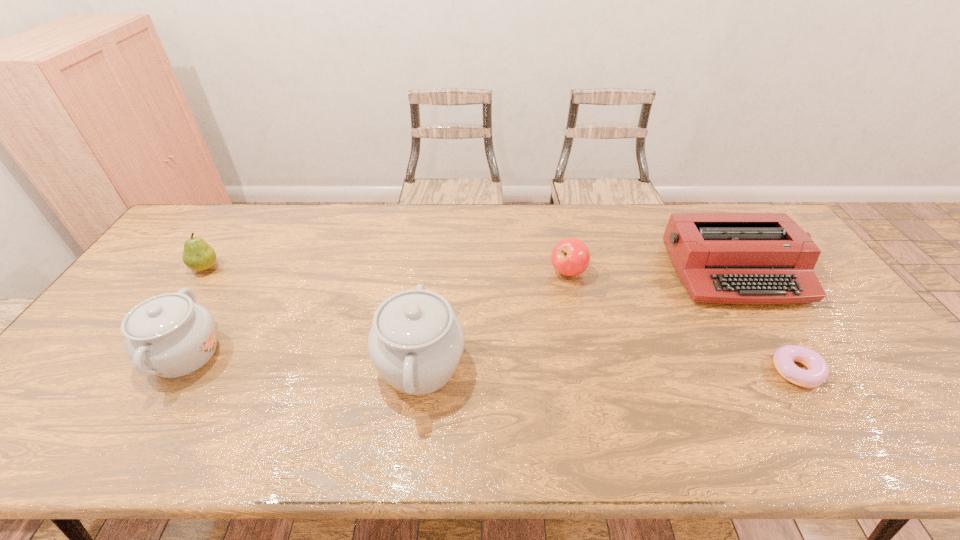
The image size is (960, 540). Find the location of `free space at the near edge`. free space at the near edge is located at coordinates (279, 395).

I want to click on free spot at the left edge of the desktop, so point(140,296).

Identify the location of vacant area between the doughnut and the pear. This screenshot has width=960, height=540. (501, 319).

Where is `vacant space that is in between the right chinaware and the pear`? This screenshot has height=540, width=960. vacant space that is in between the right chinaware and the pear is located at coordinates (313, 316).

Locate an element on the screen. vacant point located between the tallest object and the typewriter is located at coordinates (577, 319).

Where is `free space between the typewriter and the pear`? free space between the typewriter and the pear is located at coordinates (469, 270).

What are the coordinates of `unoccupied position between the third object from left to right and the third object from right to left` in the screenshot? It's located at (494, 319).

Where is `vacant region between the typewriter and the shorter chinaware`? vacant region between the typewriter and the shorter chinaware is located at coordinates (460, 313).

In order to click on vacant space that's between the pear and the typewriter in this screenshot , I will do tap(469, 270).

Identify the location of free space between the shortest object and the typewriter. (765, 322).